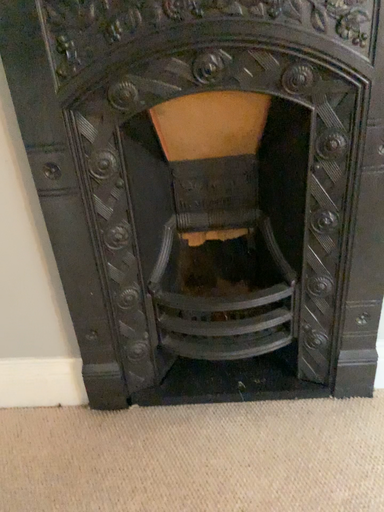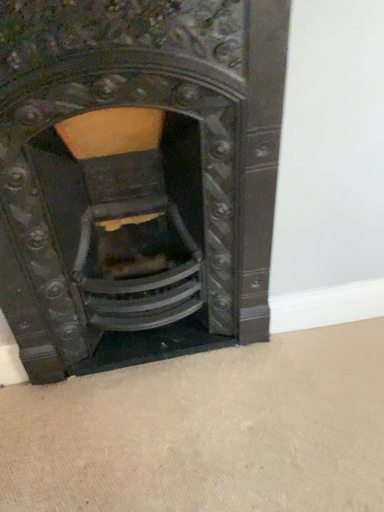
Question: How did the camera likely rotate when shooting the video?

Choices:
 (A) rotated right
 (B) rotated left

Answer: (A)